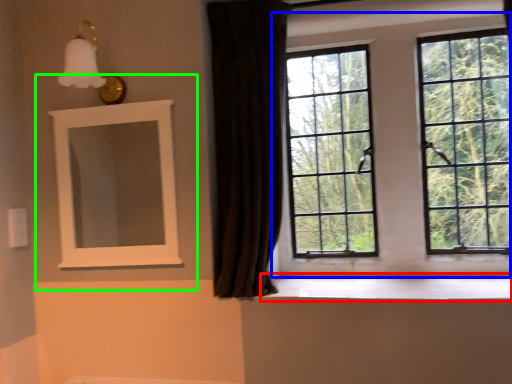
Question: Which is farther away from window sill (highlighted by a red box)? window (highlighted by a blue box) or medicine cabinet (highlighted by a green box)?

Choices:
 (A) window
 (B) medicine cabinet

Answer: (B)